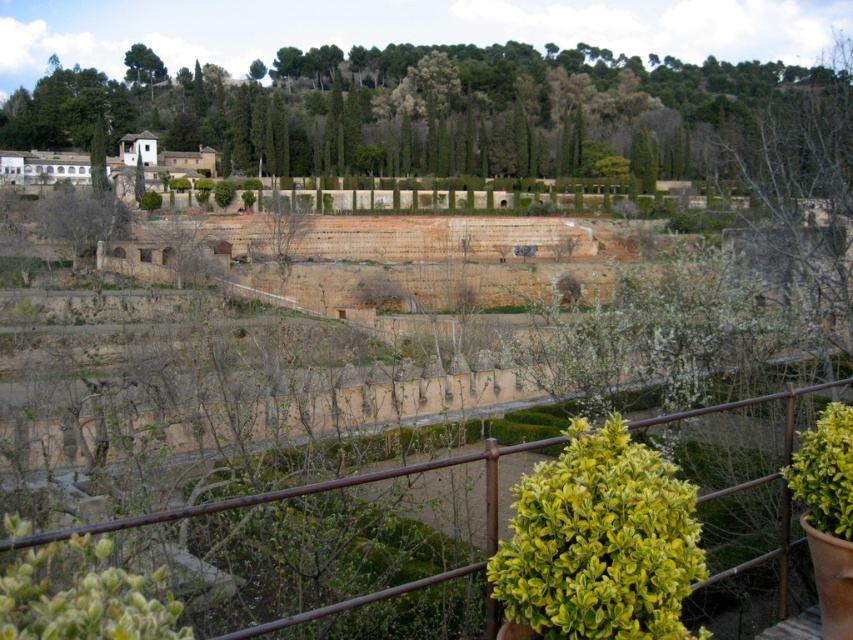
Question: Which point is farther to the camera?

Choices:
 (A) (155, 76)
 (B) (485, 497)

Answer: (A)

Question: Estimate the real-world distances between objects in this image. Which object is farther from the green leafy tree at upper center?

Choices:
 (A) yellow-green leafy bush at lower right
 (B) green leafy tree at upper left

Answer: (A)

Question: Is yellow-green leafy bush at lower right to the right of green leafy tree at upper left from the viewer's perspective?

Choices:
 (A) no
 (B) yes

Answer: (B)

Question: Is yellow-green leafy bush at lower right to the right of brown metal fence at lower center from the viewer's perspective?

Choices:
 (A) yes
 (B) no

Answer: (B)

Question: Can you confirm if yellow-green leafy bush at lower right is positioned below brown metal fence at lower center?

Choices:
 (A) no
 (B) yes

Answer: (A)

Question: Which point is farther to the camera?

Choices:
 (A) green leafy tree at upper center
 (B) green leafy tree at upper left

Answer: (B)